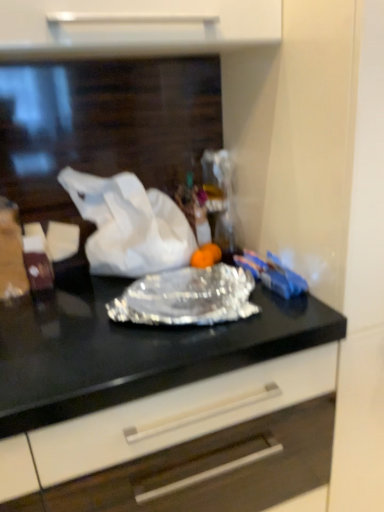
Question: Considering the positions of shiny metallic foil at center and white paper at center in the image, is shiny metallic foil at center bigger or smaller than white paper at center?

Choices:
 (A) small
 (B) big

Answer: (B)

Question: From a real-world perspective, relative to white paper at center, is shiny metallic foil at center vertically above or below?

Choices:
 (A) above
 (B) below

Answer: (B)

Question: Considering the real-world distances, which object is closest to the shiny metallic foil at center?

Choices:
 (A) silver foil wrap at center
 (B) white paper at center

Answer: (A)

Question: Estimate the real-world distances between objects in this image. Which object is closer to the shiny metallic foil at center?

Choices:
 (A) silver foil wrap at center
 (B) white paper at center

Answer: (A)